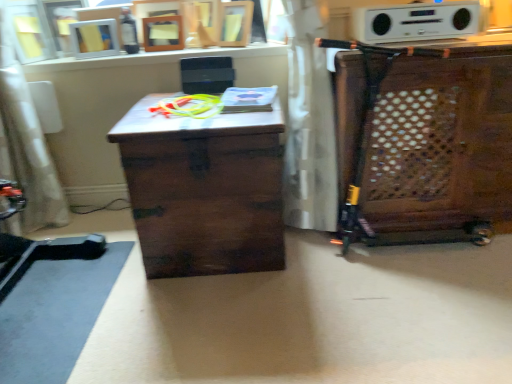
Identify the location of vacant space underneath green rubber toy at center (from a real-world perspective). The image size is (512, 384). (184, 107).